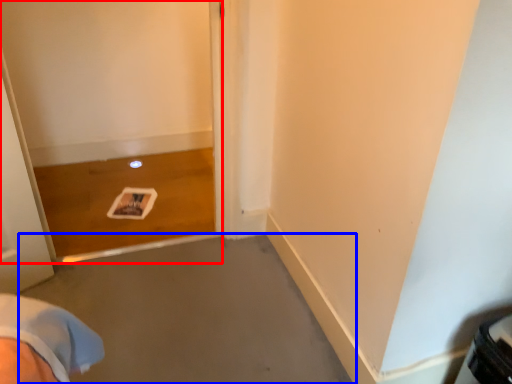
Question: Which point is further to the camera, screen door (highlighted by a red box) or concrete (highlighted by a blue box)?

Choices:
 (A) screen door
 (B) concrete

Answer: (A)